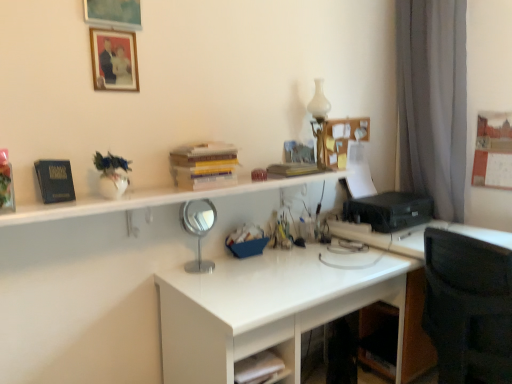
Question: Is black plastic printer at right taller or shorter than white matte drawer at lower center?

Choices:
 (A) short
 (B) tall

Answer: (B)

Question: In the image, is black plastic printer at right on the left side or the right side of white matte drawer at lower center?

Choices:
 (A) right
 (B) left

Answer: (A)

Question: Which is farther from the polished silver mirror at center?

Choices:
 (A) black plastic printer at right
 (B) matte wooden picture frame at upper center, which is the 2th picture frame from top to bottom
 (C) hardcover book at upper center, arranged as the 3th book when viewed from the front
 (D) blue plastic container at center
 (E) white matte drawer at lower center

Answer: (A)

Question: Estimate the real-world distances between objects in this image. Which object is closer to the white glossy desk at center?

Choices:
 (A) polished silver mirror at center
 (B) matte wooden picture frame at upper center, which is the 2th picture frame from top to bottom
 (C) hardcover book at left, the 3th book viewed from the back
 (D) matte wooden picture frame at upper center, which is the 1th picture frame in top-to-bottom order
 (E) black plastic printer at right

Answer: (A)